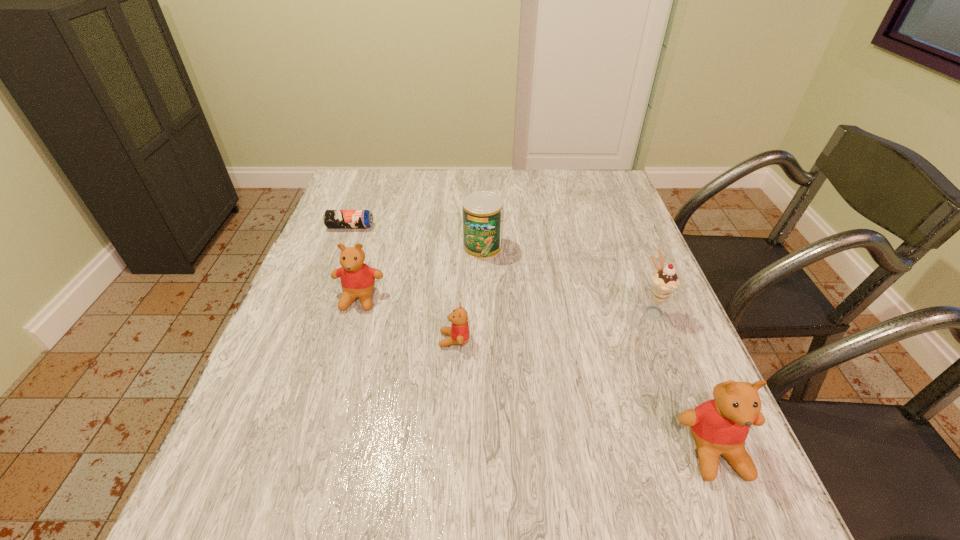
Identify which teddy bear is located as the third nearest to the can. Please provide its 2D coordinates. Your answer should be formatted as a tuple, i.e. [(x, y)], where the tuple contains the x and y coordinates of a point satisfying the conditions above.

[(720, 426)]

You are a GUI agent. You are given a task and a screenshot of the screen. Output one action in this format:
    pyautogui.click(x=<x>, y=<y>)
    Task: Click on the vacant point that satisfies the following two spatial constraints: 1. on the front-facing side of the second tallest teddy bear; 2. on the right side of the icecream
    
    Given the screenshot: What is the action you would take?
    pyautogui.click(x=355, y=310)